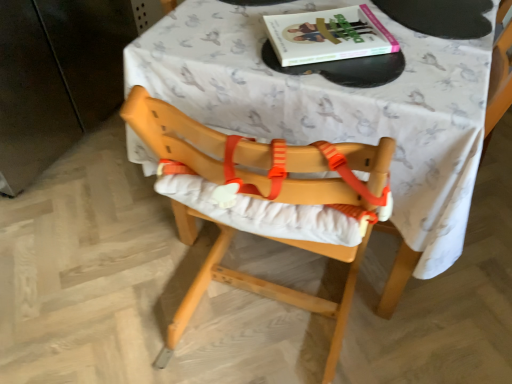
You are a GUI agent. You are given a task and a screenshot of the screen. Output one action in this format:
    pyautogui.click(x=<x>, y=<y>)
    Task: Click on the free space to the left of hardcover book at upper center
    This screenshot has width=512, height=384.
    Given the screenshot: What is the action you would take?
    pyautogui.click(x=230, y=36)